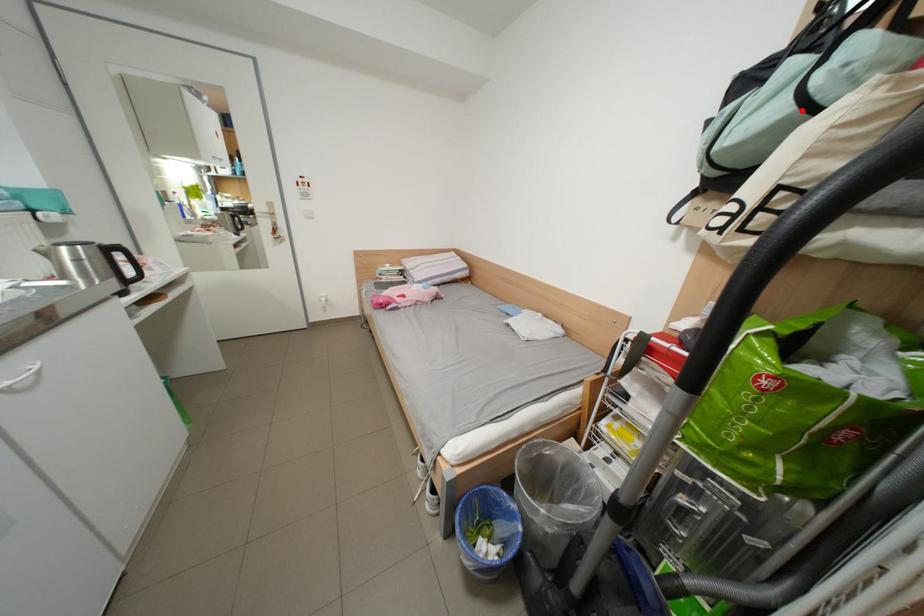
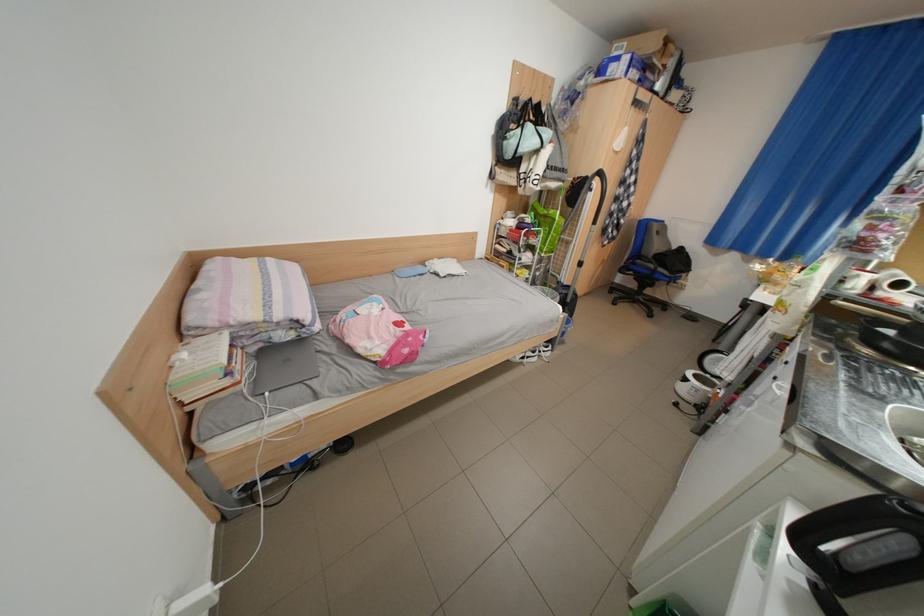
Question: A red point is marked in image1. In image2, is the corresponding 3D point closer to the camera or farther? Reply with the corresponding letter.

Choices:
 (A) The corresponding 3D point is closer.
 (B) The corresponding 3D point is farther.

Answer: (A)